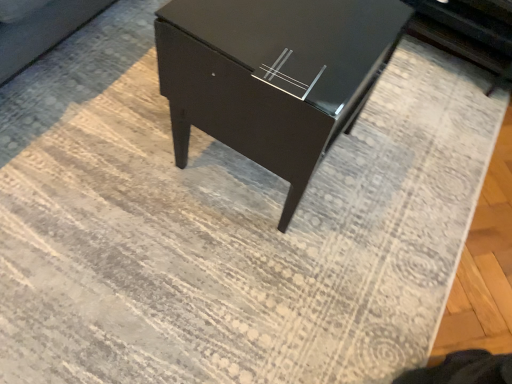
The height and width of the screenshot is (384, 512). I want to click on vacant space situated above glossy black table at center (from a real-world perspective), so click(x=295, y=35).